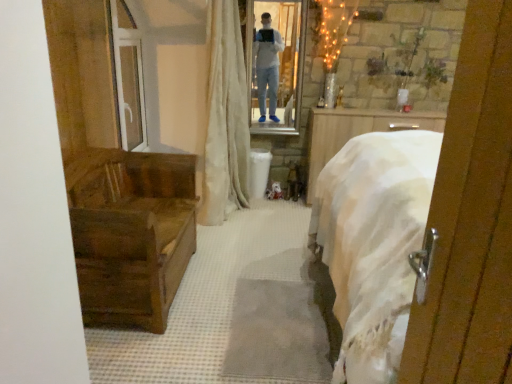
Describe the element at coordinates (128, 77) in the screenshot. Image resolution: width=512 pixels, height=384 pixels. I see `transparent glass door at upper left` at that location.

Find the location of a particular element. white glossy mirror at upper center is located at coordinates (278, 68).

How far apart are white glossy mirror at upper center and transparent glass door at upper left?

They are 4.02 feet apart.

Would you say white glossy mirror at upper center is outside transparent glass door at upper left?

Yes.

From a real-world perspective, which is physically below, white glossy mirror at upper center or transparent glass door at upper left?

transparent glass door at upper left.

Does point (266, 109) come behind point (124, 48)?

Yes.

Is white glossy mirror at upper center to the left of wooden chest at left from the viewer's perspective?

No, white glossy mirror at upper center is not to the left of wooden chest at left.

In the scene shown: From the image's perspective, which is below, white glossy mirror at upper center or wooden chest at left?

wooden chest at left, from the image's perspective.

Identify the location of mirror above the wooden chest at left (from the image's perspective). (278, 68).

Based on the photo, considering the relative positions of white glossy mirror at upper center and wooden chest at left in the image provided, is white glossy mirror at upper center in front of wooden chest at left?

No, white glossy mirror at upper center is further to the viewer.

Considering the sizes of objects transparent glass door at upper left and beige fabric curtain at center in the image provided, who is bigger, transparent glass door at upper left or beige fabric curtain at center?

With larger size is beige fabric curtain at center.

Image resolution: width=512 pixels, height=384 pixels. Find the location of `glass door located above the beige fabric curtain at center (from a real-world perspective)`. glass door located above the beige fabric curtain at center (from a real-world perspective) is located at coordinates (128, 77).

From a real-world perspective, which object stands above the other?

From a 3D spatial view, transparent glass door at upper left is above.

How far apart are transparent glass door at upper left and beige fabric curtain at center?

25.97 inches.

Based on their sizes in the image, would you say beige fabric curtain at center is bigger or smaller than wooden chest at left?

Considering their sizes, beige fabric curtain at center takes up more space than wooden chest at left.

Is beige fabric curtain at center inside or outside of wooden chest at left?

beige fabric curtain at center cannot be found inside wooden chest at left.

Does point (233, 42) come farther from viewer compared to point (170, 212)?

Yes, point (233, 42) is behind point (170, 212).

Could you tell me if beige fabric curtain at center is turned towards wooden chest at left?

No, beige fabric curtain at center is not aimed at wooden chest at left.

Which is correct: beige fabric curtain at center is inside white glossy mirror at upper center, or outside of it?

beige fabric curtain at center is not enclosed by white glossy mirror at upper center.

Between beige fabric curtain at center and white glossy mirror at upper center, which one has smaller size?

white glossy mirror at upper center is smaller.

Considering the positions of point (216, 187) and point (293, 119), is point (216, 187) closer or farther from the camera than point (293, 119)?

Point (216, 187) is closer to the camera than point (293, 119).

Would you consider beige fabric curtain at center to be distant from white glossy mirror at upper center?

beige fabric curtain at center is actually quite close to white glossy mirror at upper center.

Is wooden chest at left closer to the viewer compared to beige fabric curtain at center?

Yes, wooden chest at left is in front of beige fabric curtain at center.

Can beige fabric curtain at center be found inside wooden chest at left?

No.

Consider the image. Is wooden chest at left oriented away from beige fabric curtain at center?

No.

Is wooden chest at left directly adjacent to transparent glass door at upper left?

wooden chest at left and transparent glass door at upper left are clearly separated.

From a real-world perspective, is wooden chest at left positioned above or below transparent glass door at upper left?

wooden chest at left is situated lower than transparent glass door at upper left in the real world.

Measure the distance between wooden chest at left and transparent glass door at upper left.

The distance of wooden chest at left from transparent glass door at upper left is 74.92 centimeters.

This screenshot has width=512, height=384. I want to click on glass door above the wooden chest at left (from a real-world perspective), so click(x=128, y=77).

Where is `glass door in front of the white glossy mirror at upper center`? The image size is (512, 384). glass door in front of the white glossy mirror at upper center is located at coordinates click(x=128, y=77).

The height and width of the screenshot is (384, 512). Find the location of `furniture lying below the white glossy mirror at upper center (from the image's perspective)`. furniture lying below the white glossy mirror at upper center (from the image's perspective) is located at coordinates (130, 233).

Which object lies further to the anchor point beige fabric curtain at center, wooden chest at left or white glossy mirror at upper center?

wooden chest at left is further to beige fabric curtain at center.

Looking at the image, which one is located further to beige fabric curtain at center, white glossy mirror at upper center or wooden chest at left?

The object further to beige fabric curtain at center is wooden chest at left.

Looking at this image, considering their positions, is beige fabric curtain at center positioned further to transparent glass door at upper left than wooden chest at left?

wooden chest at left is positioned further to the anchor transparent glass door at upper left.

Considering their positions, is beige fabric curtain at center positioned closer to white glossy mirror at upper center than wooden chest at left?

The object closer to white glossy mirror at upper center is beige fabric curtain at center.

From the image, which object appears to be nearer to white glossy mirror at upper center, wooden chest at left or beige fabric curtain at center?

beige fabric curtain at center is closer to white glossy mirror at upper center.

Looking at the image, which one is located further to wooden chest at left, white glossy mirror at upper center or transparent glass door at upper left?

Among the two, white glossy mirror at upper center is located further to wooden chest at left.

Considering their positions, is transparent glass door at upper left positioned further to white glossy mirror at upper center than wooden chest at left?

Among the two, wooden chest at left is located further to white glossy mirror at upper center.

Looking at this image, looking at the image, which one is located further to wooden chest at left, transparent glass door at upper left or white glossy mirror at upper center?

Based on the image, white glossy mirror at upper center appears to be further to wooden chest at left.

You are a GUI agent. You are given a task and a screenshot of the screen. Output one action in this format:
    pyautogui.click(x=<x>, y=<y>)
    Task: Click on the curtain positioned between wooden chest at left and transparent glass door at upper left from near to far
    The image size is (512, 384).
    Given the screenshot: What is the action you would take?
    pyautogui.click(x=225, y=118)

Identify the location of curtain between wooden chest at left and white glossy mirror at upper center along the z-axis. click(225, 118).

You are a GUI agent. You are given a task and a screenshot of the screen. Output one action in this format:
    pyautogui.click(x=<x>, y=<y>)
    Task: Click on the curtain located between transparent glass door at upper left and white glossy mirror at upper center in the left-right direction
    This screenshot has width=512, height=384.
    Given the screenshot: What is the action you would take?
    pyautogui.click(x=225, y=118)

Where is `glass door between wooden chest at left and white glossy mirror at upper center in the front-back direction`? glass door between wooden chest at left and white glossy mirror at upper center in the front-back direction is located at coordinates (128, 77).